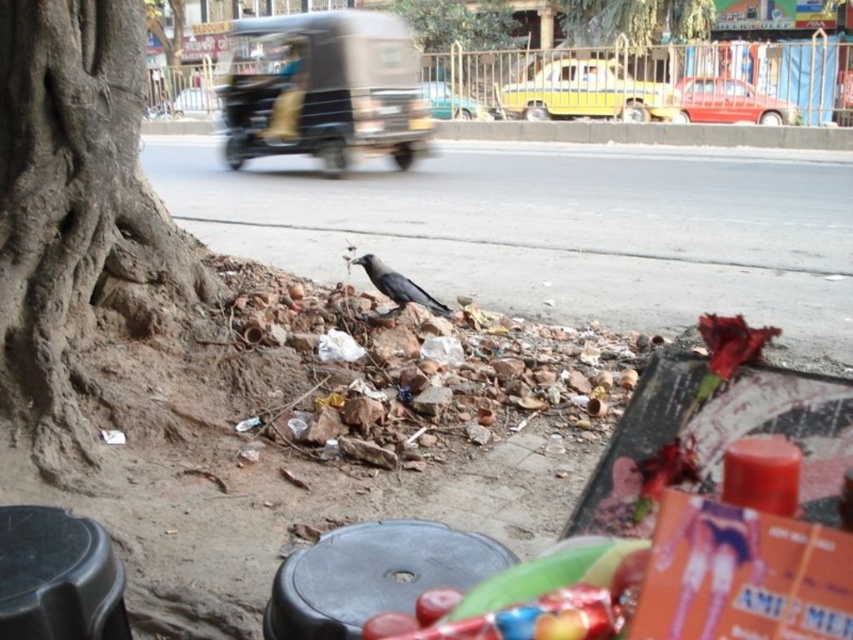
Looking at this image, you are a pedestrian looking at the scene. You see a red glossy car at upper right and a shiny black crow at center. Which object is taller in the image?

The red glossy car at upper right is taller than the shiny black crow at center.